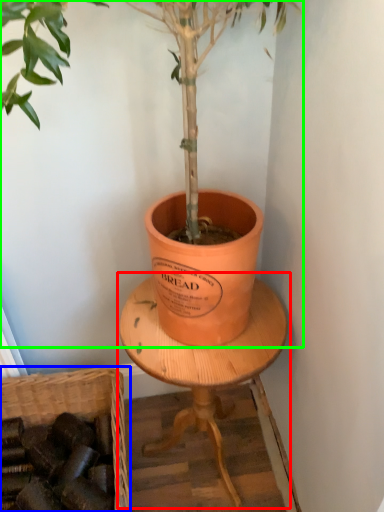
Question: Based on their relative distances, which object is farther from round table (highlighted by a red box)? Choose from basket (highlighted by a blue box) and houseplant (highlighted by a green box).

Choices:
 (A) basket
 (B) houseplant

Answer: (A)